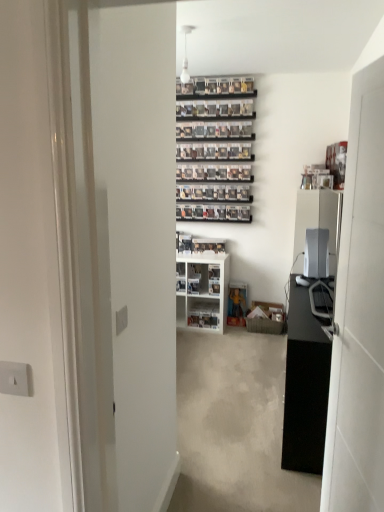
The height and width of the screenshot is (512, 384). Identify the location of white glossy shelf at center. (203, 313).

Image resolution: width=384 pixels, height=512 pixels. Describe the element at coordinates (310, 335) in the screenshot. I see `black glossy desk at right` at that location.

This screenshot has width=384, height=512. What do you see at coordinates (202, 291) in the screenshot?
I see `white glossy cabinet at center` at bounding box center [202, 291].

The image size is (384, 512). What do you see at coordinates (316, 253) in the screenshot? I see `satin silver monitor at right` at bounding box center [316, 253].

What do you see at coordinates (359, 314) in the screenshot?
I see `white glossy door at right` at bounding box center [359, 314].

Identify the location of white glossy shelf at center. (203, 313).

Considering the sizes of black glossy desk at right and white glossy shelf at center in the image, is black glossy desk at right taller or shorter than white glossy shelf at center?

Clearly, black glossy desk at right is taller compared to white glossy shelf at center.

Would you say black glossy desk at right is inside or outside white glossy shelf at center?

black glossy desk at right cannot be found inside white glossy shelf at center.

Which object is further away from the camera taking this photo, black glossy desk at right or white glossy shelf at center?

white glossy shelf at center is behind.

Considering the sizes of objects black glossy desk at right and white glossy shelf at center in the image provided, who is wider, black glossy desk at right or white glossy shelf at center?

white glossy shelf at center is wider.

Is white glossy cabinet at center positioned in front of white glossy door at right?

No.

Is white glossy cabinet at center shorter than white glossy door at right?

Indeed, white glossy cabinet at center has a lesser height compared to white glossy door at right.

Is point (205, 274) positioned after point (380, 437)?

Yes, it is.

Which is correct: black glossy desk at right is inside white glossy cabinet at center, or outside of it?

black glossy desk at right exists outside the volume of white glossy cabinet at center.

Based on the photo, how distant is black glossy desk at right from white glossy cabinet at center?

black glossy desk at right and white glossy cabinet at center are 1.25 meters apart from each other.

Which is in front, point (313, 461) or point (181, 326)?

The point (313, 461) is more forward.

Can you tell me how much black glossy desk at right and white glossy cabinet at center differ in facing direction?

black glossy desk at right and white glossy cabinet at center are facing 89.5 degrees away from each other.

Does point (322, 251) come closer to viewer compared to point (219, 318)?

Yes, it is.

How many degrees apart are the facing directions of satin silver monitor at right and white glossy cabinet at center?

satin silver monitor at right and white glossy cabinet at center are facing 89.6 degrees away from each other.

Is satin silver monitor at right next to white glossy cabinet at center?

satin silver monitor at right and white glossy cabinet at center are clearly separated.

Can you confirm if satin silver monitor at right is positioned to the right of white glossy cabinet at center?

Correct, you'll find satin silver monitor at right to the right of white glossy cabinet at center.

Is satin silver monitor at right inside the boundaries of black glossy desk at right, or outside?

satin silver monitor at right exists outside the volume of black glossy desk at right.

Which is further, (321,231) or (307,236)?

Positioned behind is point (307,236).

Considering the sizes of objects satin silver monitor at right and black glossy desk at right in the image provided, who is wider, satin silver monitor at right or black glossy desk at right?

With larger width is black glossy desk at right.

Is the depth of satin silver monitor at right less than that of black glossy desk at right?

No, satin silver monitor at right is further to the viewer.

Between point (197, 316) and point (182, 316), which one is positioned behind?

The point (182, 316) is more distant.

In the scene shown: From a real-world perspective, does white glossy shelf at center stand above white glossy cabinet at center?

No, from a real-world perspective, white glossy shelf at center is not over white glossy cabinet at center

What's the angular difference between white glossy shelf at center and white glossy cabinet at center's facing directions?

0.503 degrees separate the facing orientations of white glossy shelf at center and white glossy cabinet at center.

Based on their positions, is white glossy shelf at center located to the left or right of black glossy desk at right?

white glossy shelf at center is positioned on black glossy desk at right's left side.

Between white glossy shelf at center and black glossy desk at right, which one has less height?

With less height is white glossy shelf at center.

From the image's perspective, is white glossy shelf at center above or below black glossy desk at right?

white glossy shelf at center is situated higher than black glossy desk at right in the image.

Consider the image. Is white glossy shelf at center aimed at black glossy desk at right?

No, white glossy shelf at center is not oriented towards black glossy desk at right.

The width and height of the screenshot is (384, 512). Identify the location of entertainment center in front of the white glossy shelf at center. (310, 335).

In order to click on cabinetry behind the white glossy door at right in this screenshot , I will do `click(202, 291)`.

Looking at this image, estimate the real-world distances between objects in this image. Which object is further from black glossy desk at right, white glossy cabinet at center or satin silver monitor at right?

Based on the image, white glossy cabinet at center appears to be further to black glossy desk at right.

Looking at this image, from the image, which object appears to be farther from white glossy cabinet at center, white glossy door at right or satin silver monitor at right?

white glossy door at right is further to white glossy cabinet at center.

Based on their spatial positions, is white glossy cabinet at center or satin silver monitor at right closer to white glossy door at right?

satin silver monitor at right is closer to white glossy door at right.

Based on their spatial positions, is satin silver monitor at right or black glossy desk at right further from white glossy cabinet at center?

black glossy desk at right.

Looking at the image, which one is located further to white glossy door at right, white glossy shelf at center or black glossy desk at right?

Based on the image, white glossy shelf at center appears to be further to white glossy door at right.

Which object lies further to the anchor point white glossy cabinet at center, white glossy shelf at center or satin silver monitor at right?

Among the two, satin silver monitor at right is located further to white glossy cabinet at center.

When comparing their distances from black glossy desk at right, does white glossy door at right or satin silver monitor at right seem closer?

satin silver monitor at right lies closer to black glossy desk at right than the other object.

From the image, which object appears to be farther from white glossy cabinet at center, white glossy door at right or black glossy desk at right?

Among the two, white glossy door at right is located further to white glossy cabinet at center.

Identify the location of appliance located between white glossy door at right and white glossy cabinet at center in the depth direction. (316, 253).

What are the coordinates of `appliance located between white glossy door at right and white glossy shelf at center in the depth direction` in the screenshot? It's located at (316, 253).

Image resolution: width=384 pixels, height=512 pixels. I want to click on cabinetry between satin silver monitor at right and white glossy shelf at center from front to back, so click(x=202, y=291).

Where is `appliance positioned between black glossy desk at right and white glossy shelf at center from near to far`? The width and height of the screenshot is (384, 512). appliance positioned between black glossy desk at right and white glossy shelf at center from near to far is located at coordinates (316, 253).